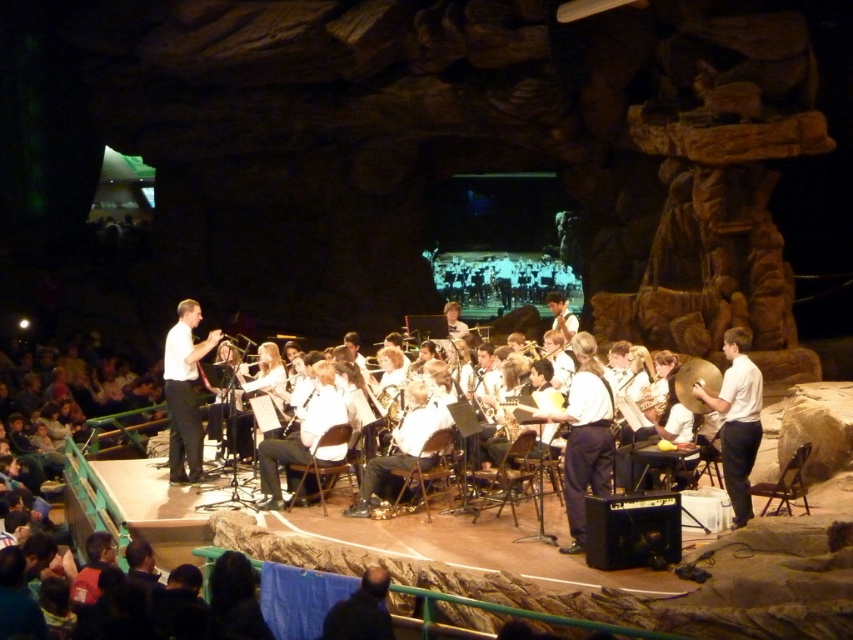
Question: Is white smooth shirt at center wider than gold metallic trumpet at center?

Choices:
 (A) no
 (B) yes

Answer: (B)

Question: Which is nearer to the shiny silver cymbal at center?

Choices:
 (A) white smooth shirt at center
 (B) metallic silver clarinet at center
 (C) gold metallic trumpet at center

Answer: (C)

Question: From the image, what is the correct spatial relationship of white smooth shirt at center in relation to gold metallic trumpet at center?

Choices:
 (A) left
 (B) right

Answer: (A)

Question: Which point is farther from the camera taking this photo?

Choices:
 (A) (302, 432)
 (B) (195, 468)
 (C) (718, 374)

Answer: (B)

Question: Which point is closer to the camera taking this photo?

Choices:
 (A) (496, 420)
 (B) (300, 433)
 (C) (706, 371)
 (D) (194, 317)

Answer: (B)

Question: Does shiny silver cymbal at center have a larger size compared to metallic silver clarinet at center?

Choices:
 (A) yes
 (B) no

Answer: (B)